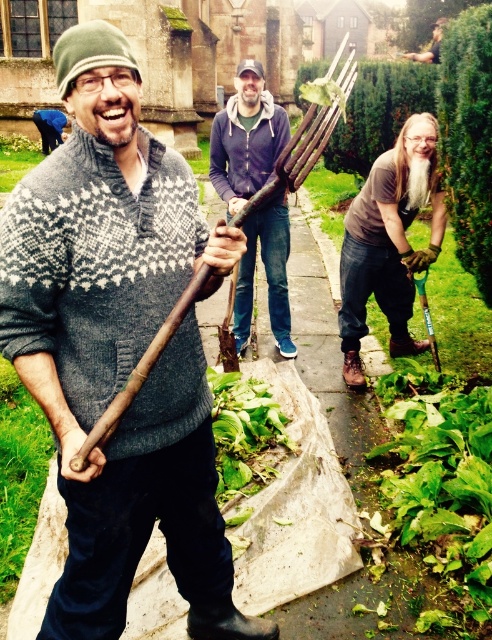
Question: Is rustic wooden rake at center thinner than green wood hedge at center?

Choices:
 (A) no
 (B) yes

Answer: (B)

Question: Does rustic wooden rake at center appear on the left side of green wood hedge at center?

Choices:
 (A) no
 (B) yes

Answer: (B)

Question: Which object appears farthest from the camera in this image?

Choices:
 (A) green leafy hedge at upper right
 (B) green wood hedge at center
 (C) rustic wooden rake at center

Answer: (B)

Question: Which object is closer to the camera taking this photo?

Choices:
 (A) rustic wooden rake at center
 (B) brown leather gloves at lower right

Answer: (B)

Question: Does knitted gray sweater at center lie behind green leafy vegetable at lower right?

Choices:
 (A) no
 (B) yes

Answer: (A)

Question: Which of these objects is positioned closest to the green leafy vegetable at center?

Choices:
 (A) green wood hedge at center
 (B) green leafy hedge at upper right

Answer: (B)